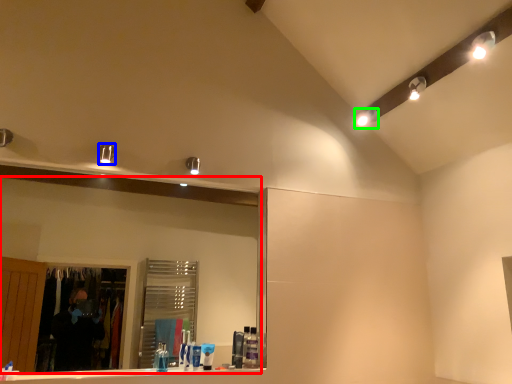
Question: Estimate the real-world distances between objects in this image. Which object is closer to mirror (highlighted by a red box), light fixture (highlighted by a blue box) or lighting (highlighted by a green box)?

Choices:
 (A) light fixture
 (B) lighting

Answer: (A)